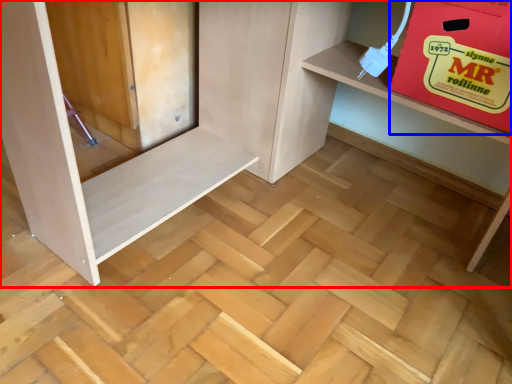
Question: Which object appears farthest to the camera in this image, furniture (highlighted by a red box) or cardboard box (highlighted by a blue box)?

Choices:
 (A) furniture
 (B) cardboard box

Answer: (B)